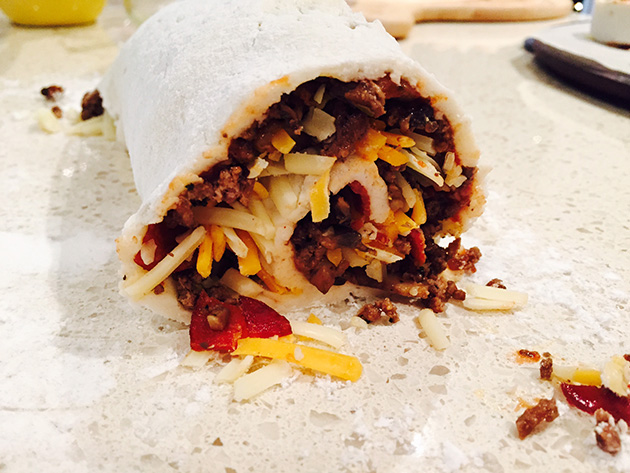
At what (x,y) coordinates should I click in order to perform the action: click on table. Please return your answer as a coordinate pair (x, y). Image resolution: width=630 pixels, height=473 pixels. Looking at the image, I should click on (537, 180).